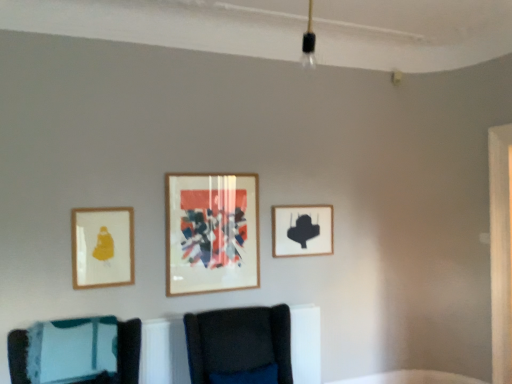
Question: In the image, is velvet dark blue chair at center, which appears as the second furniture when viewed from the left, positioned in front of or behind black matte picture frame at upper right, the 3th picture frame from the left?

Choices:
 (A) behind
 (B) front

Answer: (B)

Question: From a real-world perspective, is velvet dark blue chair at center, which appears as the second furniture when viewed from the left, physically located above or below black matte picture frame at upper right, acting as the third picture frame starting from the front?

Choices:
 (A) above
 (B) below

Answer: (B)

Question: Which is nearer to the teal fabric cushion at lower left, which is counted as the second furniture, starting from the right?

Choices:
 (A) velvet dark blue chair at center, which appears as the second furniture when viewed from the left
 (B) wooden-framed artwork at center, positioned as the 2th picture frame in right-to-left order
 (C) matte gold picture frame at left, the 3th picture frame in the back-to-front sequence
 (D) black matte picture frame at upper right, the 3th picture frame from the left

Answer: (C)

Question: Which of these objects is positioned closest to the black matte picture frame at upper right, acting as the third picture frame starting from the front?

Choices:
 (A) velvet dark blue chair at center, which appears as the second furniture when viewed from the left
 (B) matte gold picture frame at left, the first picture frame positioned from the left
 (C) teal fabric cushion at lower left, which is counted as the second furniture, starting from the right
 (D) wooden-framed artwork at center, positioned as the second picture frame in back-to-front order

Answer: (D)